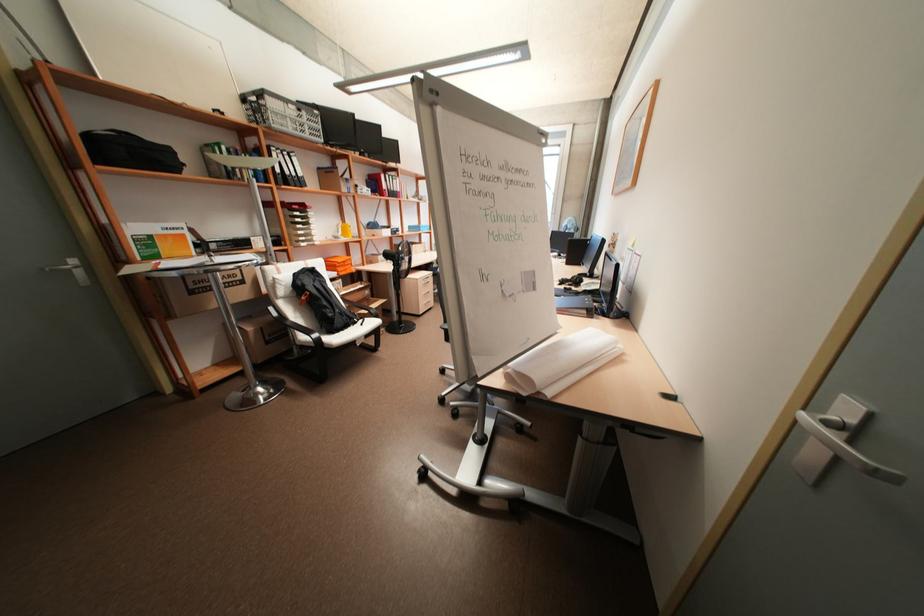
This screenshot has width=924, height=616. What do you see at coordinates (845, 446) in the screenshot?
I see `a silver door handle` at bounding box center [845, 446].